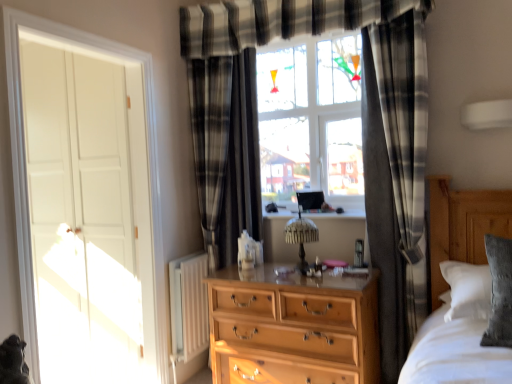
Question: From a real-world perspective, is black plaid curtain at center, the 1th curtain viewed from the left, below silvery fur cat at lower left?

Choices:
 (A) no
 (B) yes

Answer: (A)

Question: Can you confirm if black plaid curtain at center, the 2th curtain when ordered from front to back, is shorter than silvery fur cat at lower left?

Choices:
 (A) no
 (B) yes

Answer: (A)

Question: From the image's perspective, does black plaid curtain at center, the 1th curtain when ordered from back to front, appear lower than silvery fur cat at lower left?

Choices:
 (A) yes
 (B) no

Answer: (B)

Question: Does black plaid curtain at center, which appears as the second curtain when viewed from the right, lie in front of silvery fur cat at lower left?

Choices:
 (A) no
 (B) yes

Answer: (A)

Question: Does black plaid curtain at center, the 1th curtain viewed from the left, lie behind silvery fur cat at lower left?

Choices:
 (A) no
 (B) yes

Answer: (B)

Question: From a real-world perspective, is silvery fur cat at lower left above or below black plaid curtain at right, the 1th curtain in the front-to-back sequence?

Choices:
 (A) below
 (B) above

Answer: (A)

Question: Is silvery fur cat at lower left in front of or behind black plaid curtain at right, the second curtain viewed from the left, in the image?

Choices:
 (A) front
 (B) behind

Answer: (A)

Question: Considering the positions of point (16, 344) and point (408, 129), is point (16, 344) closer or farther from the camera than point (408, 129)?

Choices:
 (A) farther
 (B) closer

Answer: (B)

Question: Considering the relative positions of silvery fur cat at lower left and black plaid curtain at right, the 1th curtain in the front-to-back sequence, in the image provided, is silvery fur cat at lower left to the left or to the right of black plaid curtain at right, the 1th curtain in the front-to-back sequence,?

Choices:
 (A) right
 (B) left

Answer: (B)

Question: From the image's perspective, is black plaid curtain at right, the second curtain viewed from the left, located above or below black plaid curtain at center, the 2th curtain when ordered from front to back?

Choices:
 (A) below
 (B) above

Answer: (A)

Question: Is black plaid curtain at right, the second curtain viewed from the left, inside or outside of black plaid curtain at center, the 2th curtain when ordered from front to back?

Choices:
 (A) outside
 (B) inside

Answer: (A)

Question: Considering the positions of black plaid curtain at right, the second curtain viewed from the left, and black plaid curtain at center, the 2th curtain when ordered from front to back, in the image, is black plaid curtain at right, the second curtain viewed from the left, wider or thinner than black plaid curtain at center, the 2th curtain when ordered from front to back,?

Choices:
 (A) wide
 (B) thin

Answer: (A)

Question: From a real-world perspective, relative to black plaid curtain at center, the 1th curtain when ordered from back to front, is black plaid curtain at right, the 1th curtain in the front-to-back sequence, vertically above or below?

Choices:
 (A) above
 (B) below

Answer: (B)

Question: Is black plaid curtain at right, the 1th curtain in the front-to-back sequence, taller or shorter than white matte door at left?

Choices:
 (A) tall
 (B) short

Answer: (A)

Question: Considering the positions of black plaid curtain at right, the 1th curtain in the front-to-back sequence, and white matte door at left in the image, is black plaid curtain at right, the 1th curtain in the front-to-back sequence, bigger or smaller than white matte door at left?

Choices:
 (A) big
 (B) small

Answer: (B)